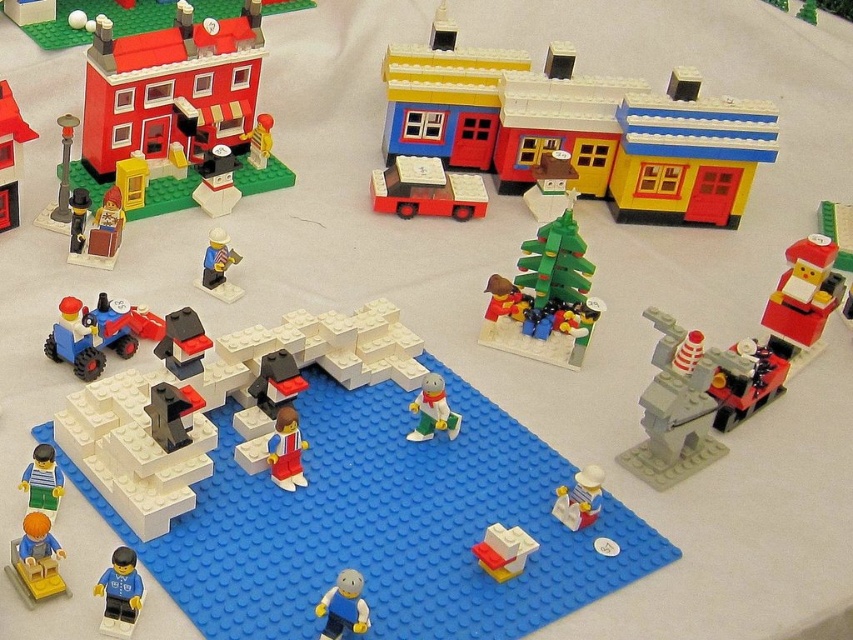
Question: Does matte black figure at left have a larger size compared to translucent plastic cup at lower center?

Choices:
 (A) yes
 (B) no

Answer: (A)

Question: Which object appears farthest from the camera in this image?

Choices:
 (A) blue matte figure at lower center
 (B) green matte christmas tree at upper center
 (C) translucent plastic cup at lower center
 (D) matte black figure at left

Answer: (B)

Question: Which object is positioned closest to the matte black penguin at center?

Choices:
 (A) blue matte truck at lower left
 (B) blue plastic figure at lower left
 (C) smooth plastic train at upper left
 (D) translucent plastic cup at lower center

Answer: (A)

Question: Is metallic red car at right positioned before matte gray figure at center?

Choices:
 (A) no
 (B) yes

Answer: (A)

Question: Can you confirm if brick red minifigure at center is bigger than smooth plastic train at upper center?

Choices:
 (A) yes
 (B) no

Answer: (A)

Question: Which point appears closest to the camera in this image?

Choices:
 (A) (15, 186)
 (B) (814, 20)
 (C) (120, 339)
 (D) (120, 572)

Answer: (D)